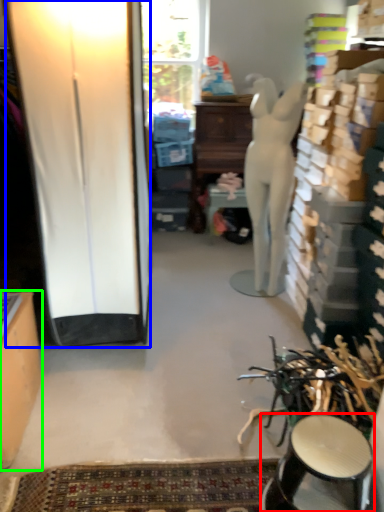
Question: Which object is positioned closest to stool (highlighted by a red box)? Select from screen door (highlighted by a blue box) and cabinetry (highlighted by a green box).

Choices:
 (A) screen door
 (B) cabinetry

Answer: (B)